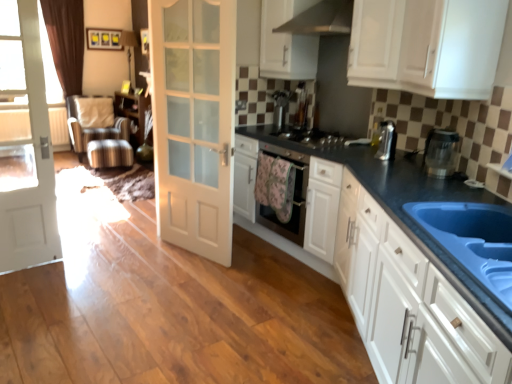
Question: Can you confirm if white glossy cabinet at upper right, positioned as the second cabinetry in bottom-to-top order, is smaller than white glossy cabinets at center, marked as the 4th cabinetry in a top-to-bottom arrangement?

Choices:
 (A) no
 (B) yes

Answer: (B)

Question: Is white glossy cabinet at upper right, the 3th cabinetry viewed from the top, wider than white glossy cabinets at center, the first cabinetry from the bottom?

Choices:
 (A) no
 (B) yes

Answer: (A)

Question: Is white glossy cabinet at upper right, the 3th cabinetry viewed from the top, placed right next to white glossy cabinets at center, marked as the 4th cabinetry in a top-to-bottom arrangement?

Choices:
 (A) yes
 (B) no

Answer: (B)

Question: Does white glossy cabinet at upper right, the 3th cabinetry viewed from the top, turn towards white glossy cabinets at center, marked as the 4th cabinetry in a top-to-bottom arrangement?

Choices:
 (A) yes
 (B) no

Answer: (B)

Question: Considering the relative positions of white glossy cabinet at upper right, positioned as the second cabinetry in bottom-to-top order, and white glossy cabinets at center, the first cabinetry from the bottom, in the image provided, is white glossy cabinet at upper right, positioned as the second cabinetry in bottom-to-top order, to the left of white glossy cabinets at center, the first cabinetry from the bottom, from the viewer's perspective?

Choices:
 (A) yes
 (B) no

Answer: (B)

Question: Considering the positions of white matte door at center, which is the 1th door in right-to-left order, and satin silver ottoman at left in the image, is white matte door at center, which is the 1th door in right-to-left order, wider or thinner than satin silver ottoman at left?

Choices:
 (A) wide
 (B) thin

Answer: (B)

Question: Considering the positions of white matte door at center, which is the 1th door in right-to-left order, and satin silver ottoman at left in the image, is white matte door at center, which is the 1th door in right-to-left order, bigger or smaller than satin silver ottoman at left?

Choices:
 (A) small
 (B) big

Answer: (A)

Question: Is point (231, 220) positioned closer to the camera than point (108, 97)?

Choices:
 (A) farther
 (B) closer

Answer: (B)

Question: Considering the relative positions of white matte door at center, which is the second door in left-to-right order, and satin silver ottoman at left in the image provided, is white matte door at center, which is the second door in left-to-right order, to the left or to the right of satin silver ottoman at left?

Choices:
 (A) left
 (B) right

Answer: (B)

Question: Would you say satin silver coffee machine at center, the 2th coffee machine in the front-to-back sequence, is to the left or to the right of white glossy cabinet at upper center, which is the 4th cabinetry in bottom-to-top order, in the picture?

Choices:
 (A) right
 (B) left

Answer: (B)

Question: From their relative heights in the image, would you say satin silver coffee machine at center, placed as the second coffee machine when sorted from bottom to top, is taller or shorter than white glossy cabinet at upper center, marked as the first cabinetry in a top-to-bottom arrangement?

Choices:
 (A) tall
 (B) short

Answer: (B)

Question: From the image's perspective, relative to white glossy cabinet at upper center, which is the 4th cabinetry in bottom-to-top order, is satin silver coffee machine at center, which is the 1th coffee machine in back-to-front order, above or below?

Choices:
 (A) below
 (B) above

Answer: (A)

Question: Does point (289, 92) appear closer or farther from the camera than point (283, 62)?

Choices:
 (A) farther
 (B) closer

Answer: (A)

Question: Is satin silver ottoman at left inside the boundaries of white matte door at center, which is the second door in left-to-right order, or outside?

Choices:
 (A) inside
 (B) outside

Answer: (B)

Question: From the image's perspective, relative to white matte door at center, which is the 1th door in right-to-left order, is satin silver ottoman at left above or below?

Choices:
 (A) above
 (B) below

Answer: (A)